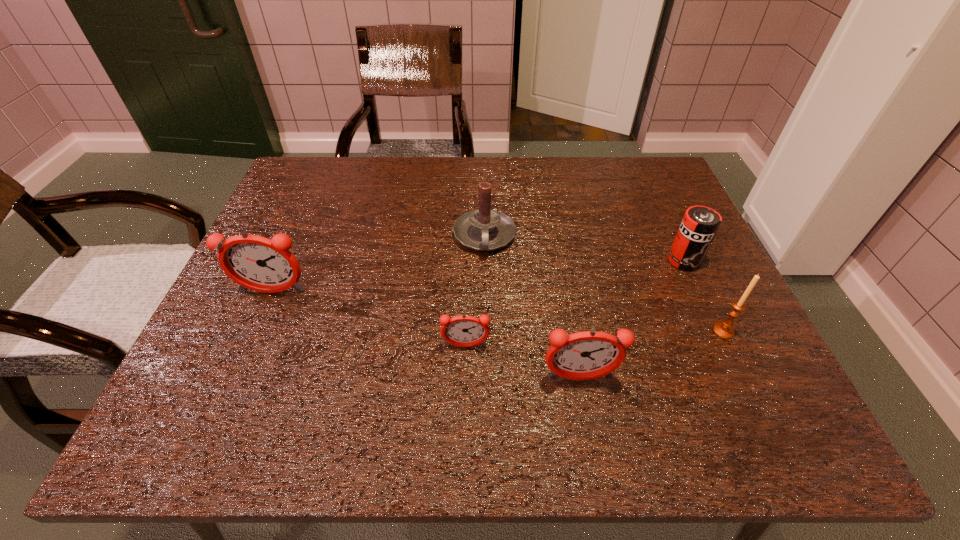
Find the location of a particular element. free region that satisfies the following two spatial constraints: 1. on the side of the candle with the handle loop; 2. on the left side of the candle_holder is located at coordinates (486, 331).